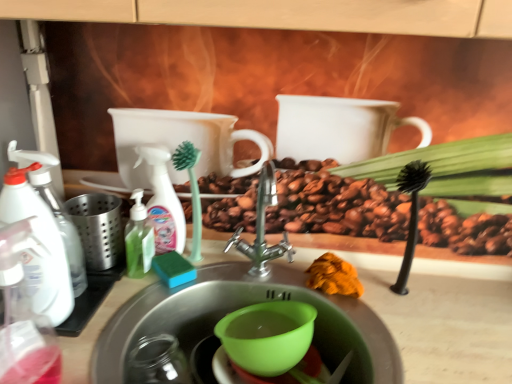
Question: Can you confirm if white plastic spray bottle at left, the 3th cleaning product from the right, is positioned to the left of orange fabric at sink?

Choices:
 (A) no
 (B) yes

Answer: (B)

Question: Is white plastic spray bottle at left, which appears as the 1th cleaning product when viewed from the left, located outside orange fabric at sink?

Choices:
 (A) no
 (B) yes

Answer: (B)

Question: From the image's perspective, is white plastic spray bottle at left, the 3th cleaning product from the right, below orange fabric at sink?

Choices:
 (A) yes
 (B) no

Answer: (B)

Question: From a real-world perspective, does white plastic spray bottle at left, the 3th cleaning product from the right, sit lower than orange fabric at sink?

Choices:
 (A) no
 (B) yes

Answer: (A)

Question: Is white plastic spray bottle at left, the 3th cleaning product from the right, facing towards orange fabric at sink?

Choices:
 (A) yes
 (B) no

Answer: (B)

Question: Based on their positions, is black plastic brush at right, which is counted as the first plant, starting from the right, located to the left or right of orange fabric at sink?

Choices:
 (A) left
 (B) right

Answer: (B)

Question: In terms of width, does black plastic brush at right, which is counted as the first plant, starting from the right, look wider or thinner when compared to orange fabric at sink?

Choices:
 (A) wide
 (B) thin

Answer: (B)

Question: Is black plastic brush at right, the 2th plant in the left-to-right sequence, spatially inside orange fabric at sink, or outside of it?

Choices:
 (A) inside
 (B) outside

Answer: (B)

Question: Looking at the image, does black plastic brush at right, the 2th plant in the left-to-right sequence, seem bigger or smaller compared to orange fabric at sink?

Choices:
 (A) small
 (B) big

Answer: (B)

Question: In terms of width, does green plastic scrub brush at center, positioned as the 1th plant in left-to-right order, look wider or thinner when compared to green plastic bowl at sink?

Choices:
 (A) wide
 (B) thin

Answer: (B)

Question: From the image's perspective, is green plastic scrub brush at center, the second plant from the right, located above or below green plastic bowl at sink?

Choices:
 (A) below
 (B) above

Answer: (B)

Question: Considering the positions of point (192, 244) and point (230, 319), is point (192, 244) closer or farther from the camera than point (230, 319)?

Choices:
 (A) closer
 (B) farther

Answer: (B)

Question: Is green plastic scrub brush at center, positioned as the 1th plant in left-to-right order, situated inside green plastic bowl at sink or outside?

Choices:
 (A) outside
 (B) inside

Answer: (A)

Question: Is green plastic scrub brush at center, the second plant from the right, bigger or smaller than orange fabric at sink?

Choices:
 (A) big
 (B) small

Answer: (B)

Question: From a real-world perspective, is green plastic scrub brush at center, the second plant from the right, physically located above or below orange fabric at sink?

Choices:
 (A) below
 (B) above

Answer: (B)